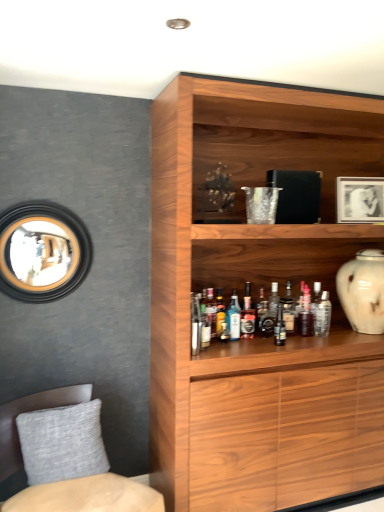
Where is `free location above gold-framed mirror at upper left (from a real-world perspective)`? free location above gold-framed mirror at upper left (from a real-world perspective) is located at coordinates (41, 199).